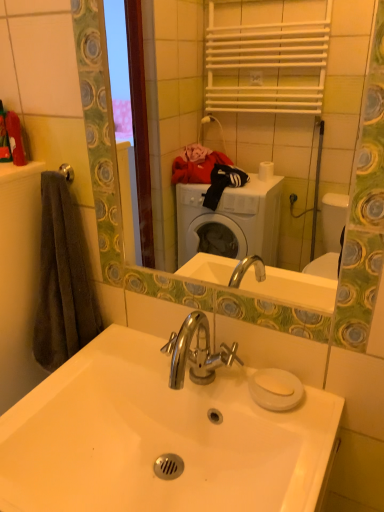
Measure the distance between white glossy mirror at upper center and camera.

white glossy mirror at upper center is 7.24 feet away from camera.

Describe the element at coordinates (63, 279) in the screenshot. I see `dark gray towel at left` at that location.

Where is `white glossy mirror at upper center`? The width and height of the screenshot is (384, 512). white glossy mirror at upper center is located at coordinates (178, 95).

You are a GUI agent. You are given a task and a screenshot of the screen. Output one action in this format:
    pyautogui.click(x=<x>, y=<y>)
    Task: Click on the sink that is below the white glossy mirror at upper center (from the image's perspective)
    The height and width of the screenshot is (512, 384).
    Given the screenshot: What is the action you would take?
    pyautogui.click(x=159, y=438)

From the image's perspective, is white glossy mirror at upper center positioned above or below white glossy sink at center?

Clearly, from the image's perspective, white glossy mirror at upper center is above white glossy sink at center.

Looking at this image, is white glossy sink at center a part of white glossy mirror at upper center?

That's incorrect, white glossy sink at center is not inside white glossy mirror at upper center.

Between silver metallic towel bar at upper left and dark gray towel at left, which one appears on the left side from the viewer's perspective?

dark gray towel at left.

In order to click on towel bar behind the dark gray towel at left in this screenshot , I will do `click(67, 172)`.

How many degrees apart are the facing directions of silver metallic towel bar at upper left and dark gray towel at left?

They differ by 4.57e-05 degrees in their facing directions.

Does point (71, 182) come in front of point (55, 316)?

Yes, point (71, 182) is in front of point (55, 316).

From the image's perspective, between dark gray towel at left and white glossy sink at center, which one is located above?

From the image's view, dark gray towel at left is above.

Is there a large distance between dark gray towel at left and white glossy sink at center?

Actually, dark gray towel at left and white glossy sink at center are a little close together.

Between point (52, 213) and point (76, 500), which one is positioned behind?

The point (52, 213) is behind.

From the picture: Does dark gray towel at left lie behind white glossy sink at center?

Yes.

Considering the relative sizes of silver metallic towel bar at upper left and white glossy mirror at upper center in the image provided, is silver metallic towel bar at upper left bigger than white glossy mirror at upper center?

No, silver metallic towel bar at upper left is not bigger than white glossy mirror at upper center.

From the image's perspective, between silver metallic towel bar at upper left and white glossy mirror at upper center, which one is located above?

silver metallic towel bar at upper left.

Is silver metallic towel bar at upper left positioned beyond the bounds of white glossy mirror at upper center?

Yes.

Looking at their sizes, would you say silver metallic towel bar at upper left is wider or thinner than white glossy mirror at upper center?

Considering their sizes, silver metallic towel bar at upper left looks slimmer than white glossy mirror at upper center.

Locate an element on the screen. mirror above the dark gray towel at left (from the image's perspective) is located at coordinates (178, 95).

Is white glossy mirror at upper center positioned with its back to dark gray towel at left?

white glossy mirror at upper center is not turned away from dark gray towel at left.

Is white glossy mirror at upper center next to silver metallic towel bar at upper left?

No.

Can you confirm if white glossy mirror at upper center is taller than silver metallic towel bar at upper left?

Correct, white glossy mirror at upper center is much taller as silver metallic towel bar at upper left.

Does point (305, 219) come in front of point (72, 169)?

No, (305, 219) is further to viewer.

Image resolution: width=384 pixels, height=512 pixels. I want to click on sink below the white glossy mirror at upper center (from the image's perspective), so click(x=159, y=438).

Is white glossy sink at center facing towards white glossy mirror at upper center?

No, white glossy sink at center is not turned towards white glossy mirror at upper center.

Is white glossy sink at center to the left of white glossy mirror at upper center from the viewer's perspective?

Yes.

Identify the location of mirror located behind the white glossy sink at center. (178, 95).

This screenshot has height=512, width=384. What are the coordinates of `bath towel lying on the left of silver metallic towel bar at upper left` in the screenshot? It's located at (63, 279).

Estimate the real-world distances between objects in this image. Which object is closer to dark gray towel at left, silver metallic towel bar at upper left or white glossy mirror at upper center?

silver metallic towel bar at upper left.

When comparing their distances from dark gray towel at left, does silver metallic towel bar at upper left or white glossy sink at center seem further?

white glossy sink at center.

Considering their positions, is white glossy sink at center positioned closer to white glossy mirror at upper center than silver metallic towel bar at upper left?

silver metallic towel bar at upper left is positioned closer to the anchor white glossy mirror at upper center.

Considering their positions, is dark gray towel at left positioned closer to white glossy sink at center than silver metallic towel bar at upper left?

The object closer to white glossy sink at center is dark gray towel at left.

Considering their positions, is white glossy sink at center positioned further to dark gray towel at left than white glossy mirror at upper center?

white glossy mirror at upper center is further to dark gray towel at left.

Which object lies further to the anchor point white glossy sink at center, dark gray towel at left or white glossy mirror at upper center?

white glossy mirror at upper center is further to white glossy sink at center.

Based on their spatial positions, is white glossy sink at center or silver metallic towel bar at upper left closer to dark gray towel at left?

silver metallic towel bar at upper left is positioned closer to the anchor dark gray towel at left.

Estimate the real-world distances between objects in this image. Which object is closer to white glossy sink at center, white glossy mirror at upper center or dark gray towel at left?

Among the two, dark gray towel at left is located nearer to white glossy sink at center.

You are a GUI agent. You are given a task and a screenshot of the screen. Output one action in this format:
    pyautogui.click(x=<x>, y=<y>)
    Task: Click on the bath towel positioned between white glossy mirror at upper center and silver metallic towel bar at upper left from near to far
    The image size is (384, 512).
    Given the screenshot: What is the action you would take?
    pyautogui.click(x=63, y=279)

Locate an element on the screen. bath towel between white glossy mirror at upper center and white glossy sink at center in the vertical direction is located at coordinates (63, 279).

In order to click on mirror between silver metallic towel bar at upper left and white glossy sink at center from top to bottom in this screenshot , I will do pos(178,95).

This screenshot has height=512, width=384. I want to click on bath towel between silver metallic towel bar at upper left and white glossy sink at center vertically, so click(x=63, y=279).